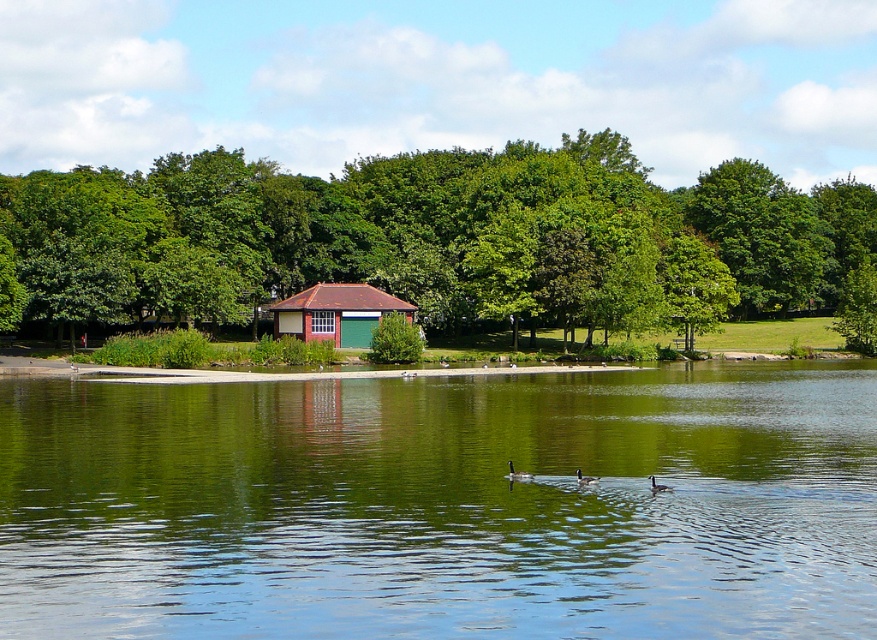
In the scene shown: You are a photographer trying to capture the ducks in the lake. You notice the brown matte duck at center and the dark gray matte duck at center. Which duck should you focus on if you want to photograph the larger one?

The brown matte duck at center is bigger than the dark gray matte duck at center, so you should focus on the brown matte duck at center for the larger subject.

You are standing at the point marked by the coordinate point [517,474], which is where the brown matte duck at center is located. Looking around, you notice the small red roofed building with white walls in the middle ground. In which direction relative to your current position is the building located?

The small red roofed building with white walls is located behind the brown matte duck at center because the duck is at the center while the building is in the middle ground, which is further back from the viewer compared to the foreground where the duck is situated.

From the picture: You are standing at the lakeside and want to reach the point marked as point (375, 577). Given that your walking speed is 1.5 meters per second, how long will it take you to reach that point?

The point (375, 577) is 15.75 meters away from the viewer. At a walking speed of 1.5 meters per second, it will take 10.5 seconds to reach the point.